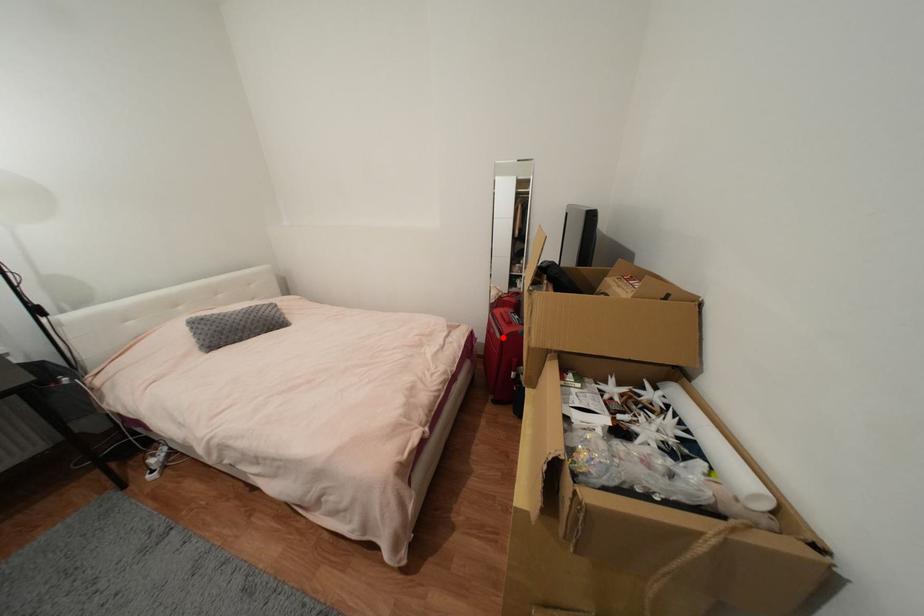
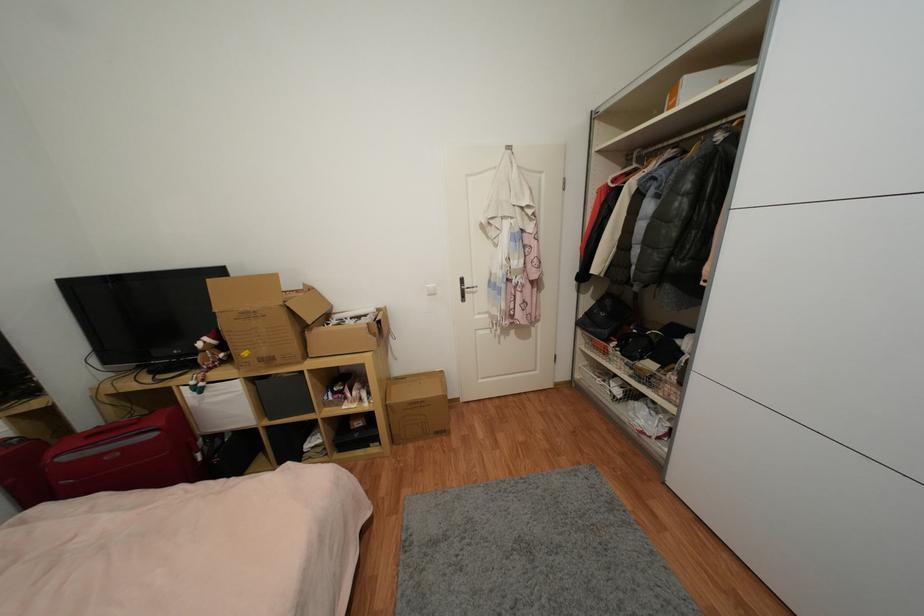
Find the pixel in the second image that matches the highlighted location in the first image.

(157, 436)